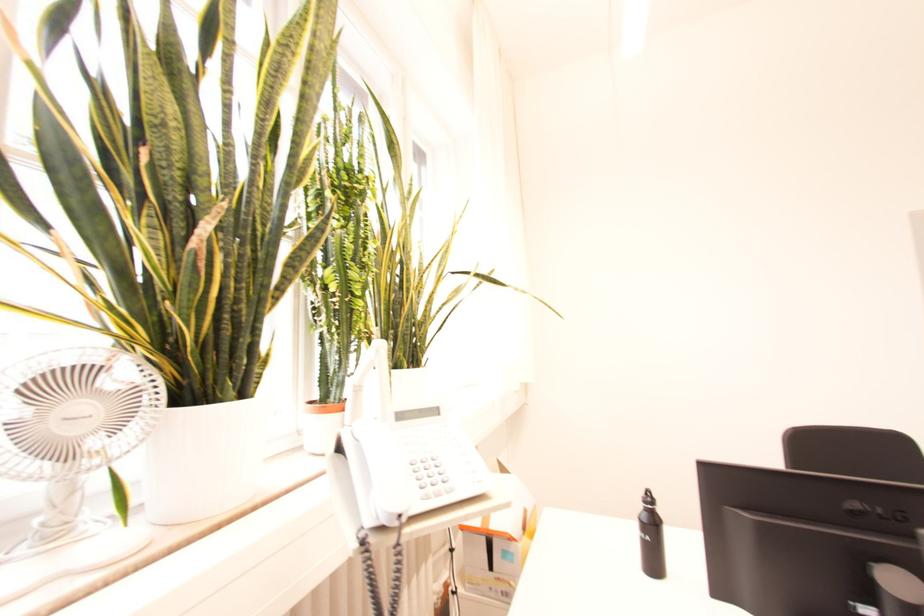
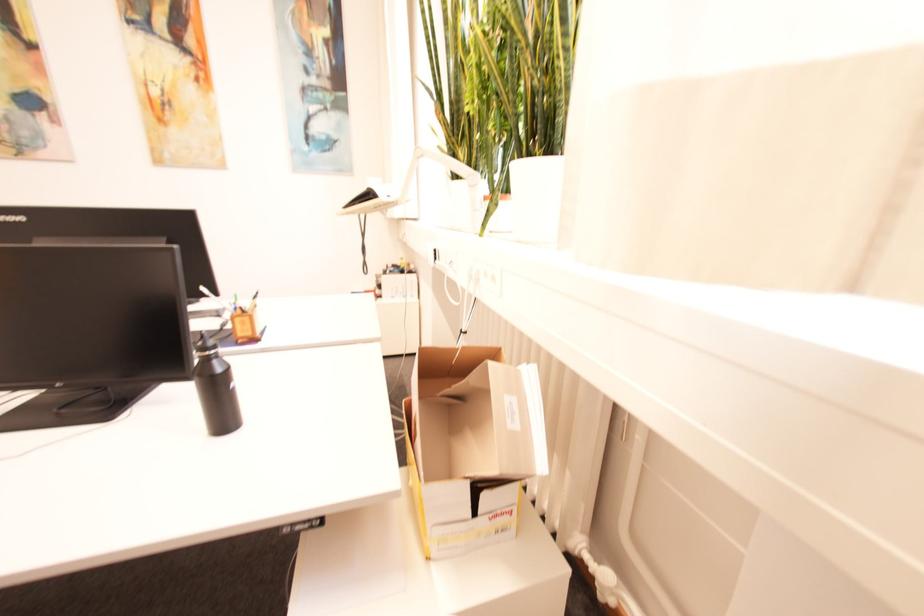
Question: I am providing you with two images of the same scene from different viewpoints. After the viewpoint changes to image2, which objects are now occluded?

Choices:
 (A) kettle lid button
 (B) wooden pen holder
 (C) white plant pot
 (D) desk lamp head

Answer: (C)